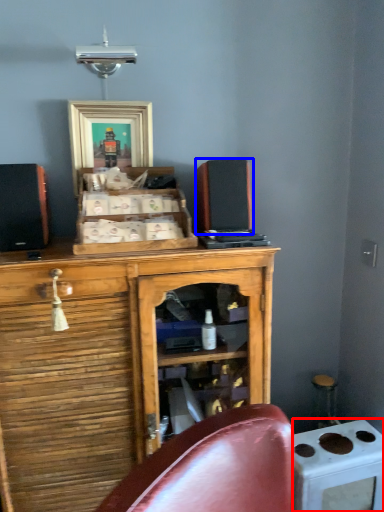
Question: Which object appears farthest to the camera in this image, appliance (highlighted by a red box) or speaker (highlighted by a blue box)?

Choices:
 (A) appliance
 (B) speaker

Answer: (A)